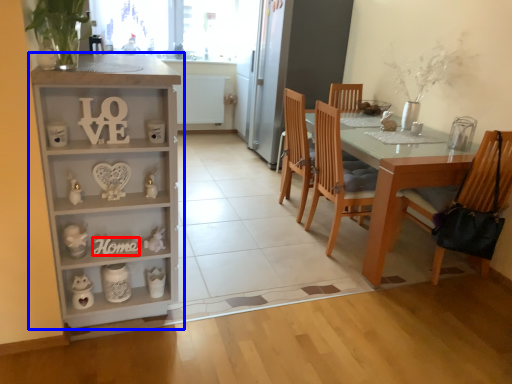
Question: Which object appears closest to the camera in this image, number (highlighted by a red box) or cabinetry (highlighted by a blue box)?

Choices:
 (A) number
 (B) cabinetry

Answer: (B)